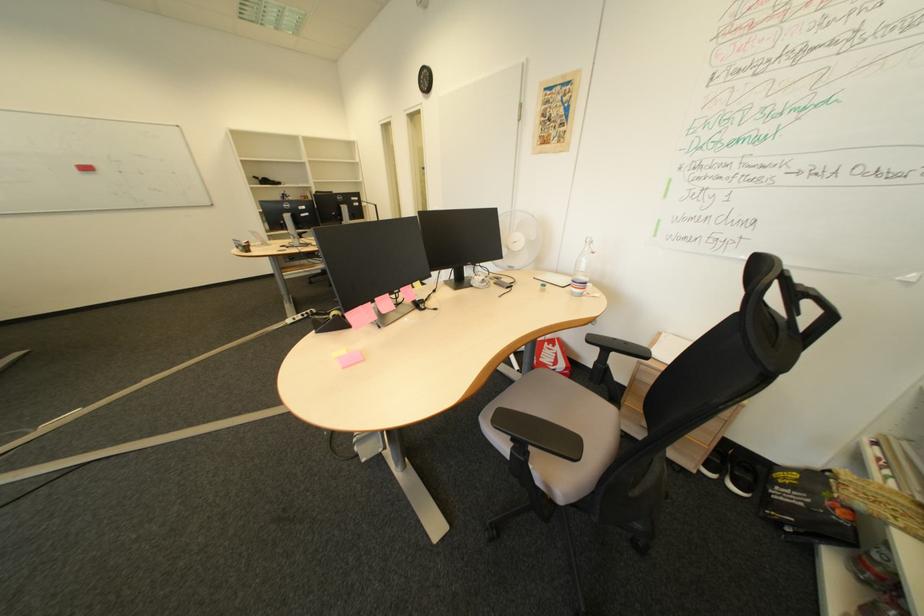
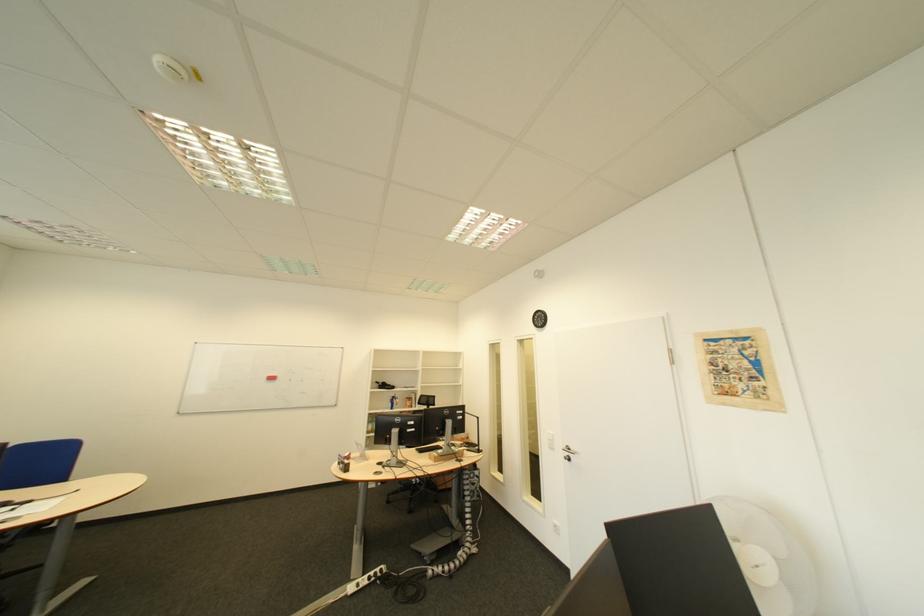
The first image is from the beginning of the video and the second image is from the end. How did the camera likely rotate when shooting the video?

The rotation direction of the camera is left-up.